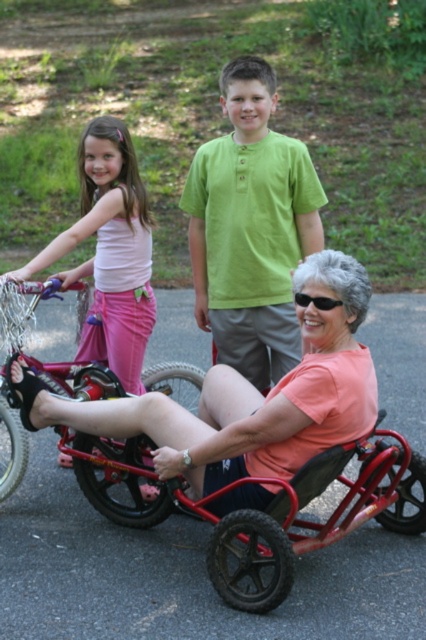
From the picture: You are a photographer trying to capture a photo of both the green cotton shirt at center and the metallic red bicycle at center. Based on their positions, which object should you focus on first to ensure both are in the frame?

The green cotton shirt at center is to the right of the metallic red bicycle at center, so you should focus on the metallic red bicycle at center first to ensure both are in the frame.

From the picture: What is located at the coordinates point (250, 227)?

The green cotton shirt at center is located at point (250, 227).

You are a delivery person who needs to place a small package between the green cotton shirt at center and the metallic red bicycle at center. The package requires a space of 3 feet. Is there enough space between them?

The green cotton shirt at center is 3.44 feet from metallic red bicycle at center, so yes, the package can be placed between them since the distance is sufficient.